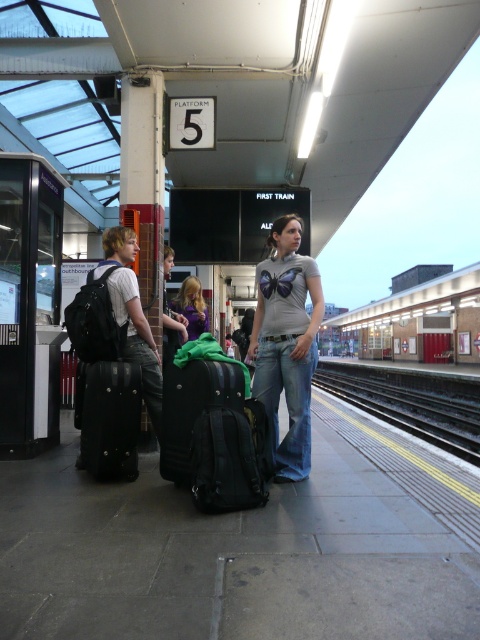
Is point (91, 397) positioned before point (191, 390)?

No, it is behind (191, 390).

Which of these two, black matte suitcase at left or black textured suitcase at center, stands shorter?

With less height is black textured suitcase at center.

Is point (119, 465) positioned behind point (165, 426)?

Yes, it is.

Where is `black matte suitcase at left`? This screenshot has height=640, width=480. black matte suitcase at left is located at coordinates (110, 419).

Between point (297, 358) and point (116, 410), which one is positioned behind?

The point (116, 410) is more distant.

Who is positioned more to the left, matte gray t-shirt with butterfly design at center or black matte suitcase at left?

black matte suitcase at left is more to the left.

Between point (307, 260) and point (109, 376), which one is positioned behind?

The point (307, 260) is more distant.

The height and width of the screenshot is (640, 480). Identify the location of matte gray t-shirt with butterfly design at center. (286, 344).

The height and width of the screenshot is (640, 480). What do you see at coordinates (410, 410) in the screenshot?
I see `black metal train track at lower center` at bounding box center [410, 410].

Does black metal train track at lower center have a smaller size compared to matte purple shirt at center?

No, black metal train track at lower center is not smaller than matte purple shirt at center.

Where is `black metal train track at lower center`? The image size is (480, 640). black metal train track at lower center is located at coordinates (410, 410).

Find the location of `black metal train track at lower center`. black metal train track at lower center is located at coordinates (410, 410).